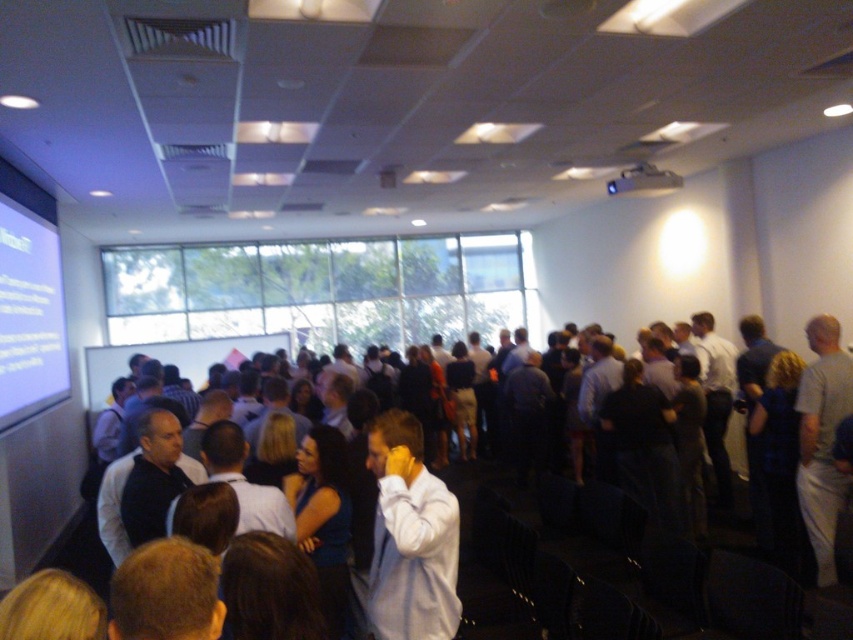
In the conference room scene, there is a white glossy projection screen at upper left and a black plastic projector at upper center. Which object is positioned to the left of the other?

The white glossy projection screen at upper left is positioned to the left of the black plastic projector at upper center.

You are organizing a presentation and need to ensure that the white matte shirt at center does not block the white glossy projection screen at upper left. Given their sizes, which one is wider and therefore more likely to obstruct the screen if positioned in front?

The white glossy projection screen at upper left is wider than the white matte shirt at center, so it is more likely to obstruct the screen if positioned in front.